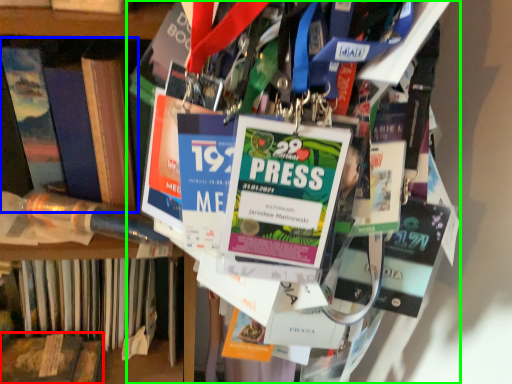
Question: Considering the real-world distances, which object is closest to book (highlighted by a red box)? book (highlighted by a blue box) or book (highlighted by a green box).

Choices:
 (A) book
 (B) book

Answer: (A)